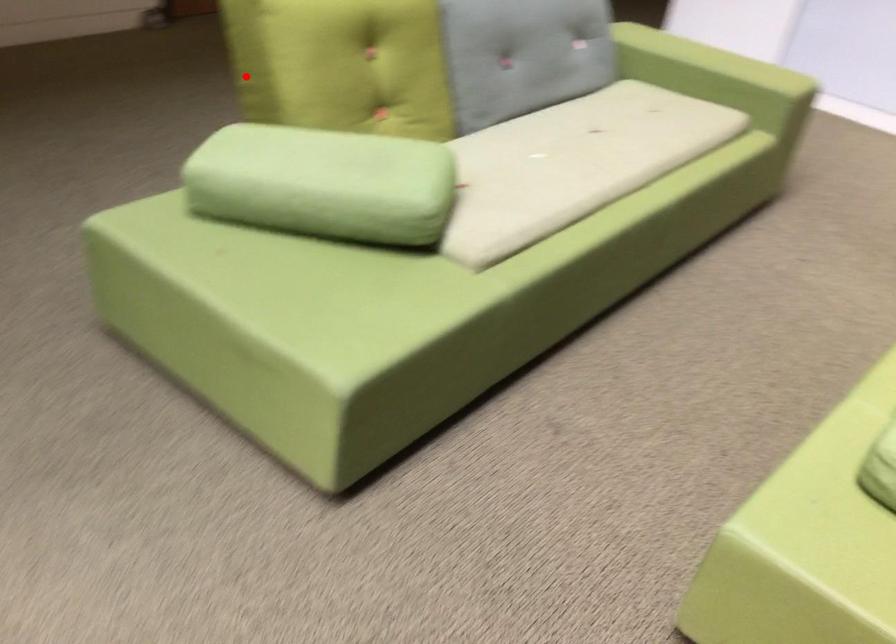
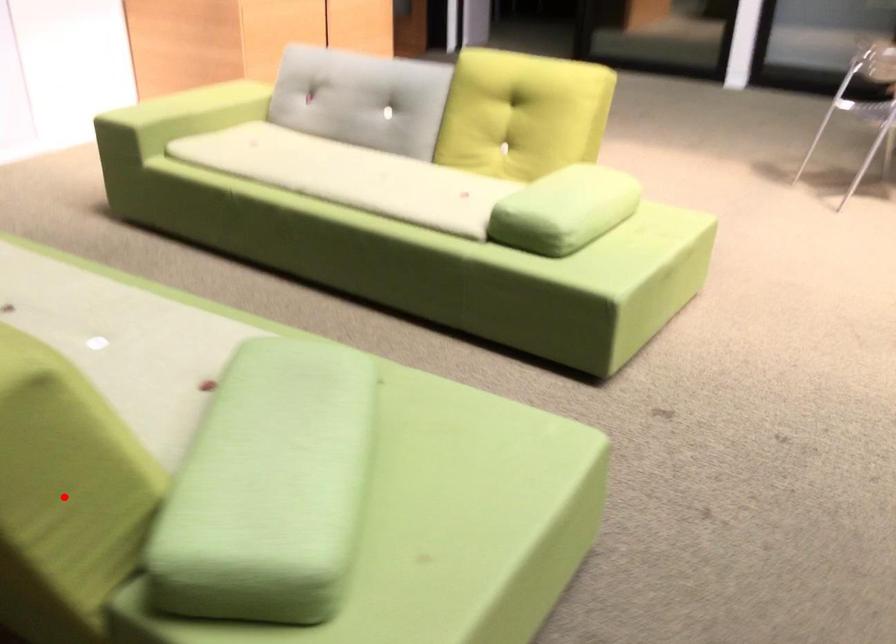
I am providing you with two images of the same scene from different viewpoints. A red point is marked on the first image and another point is marked on the second image. Is the marked point in image1 the same physical position as the marked point in image2?

Yes